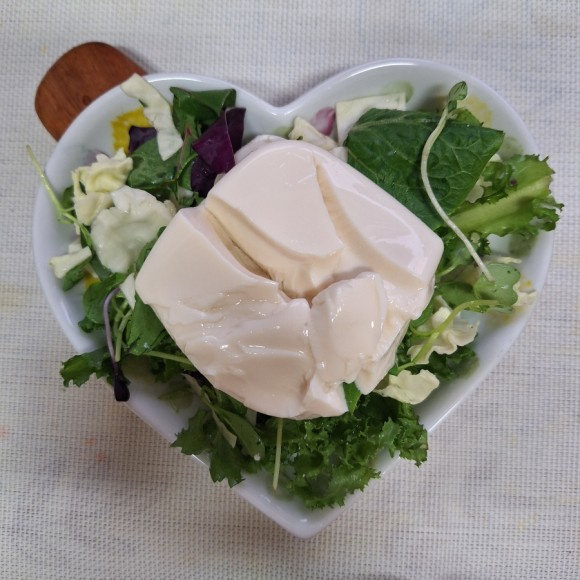
The width and height of the screenshot is (580, 580). In order to click on shadow from bowl in this screenshot , I will do `click(278, 93)`.